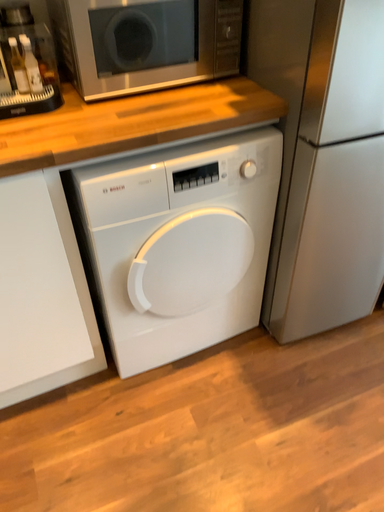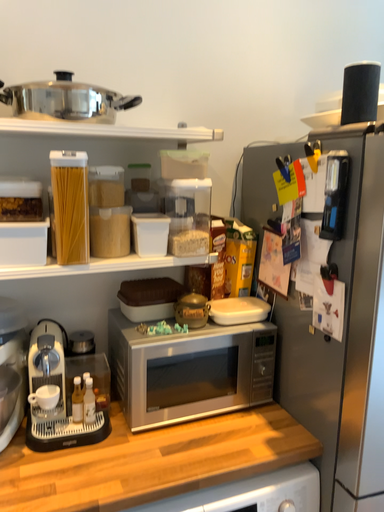
Question: Which way did the camera rotate in the video?

Choices:
 (A) rotated downward
 (B) rotated upward

Answer: (B)